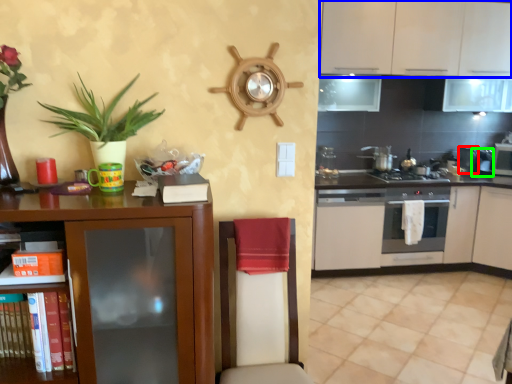
Question: Which object is the farthest from appliance (highlighted by a red box)? Choose among these: cabinetry (highlighted by a blue box) or appliance (highlighted by a green box).

Choices:
 (A) cabinetry
 (B) appliance

Answer: (A)